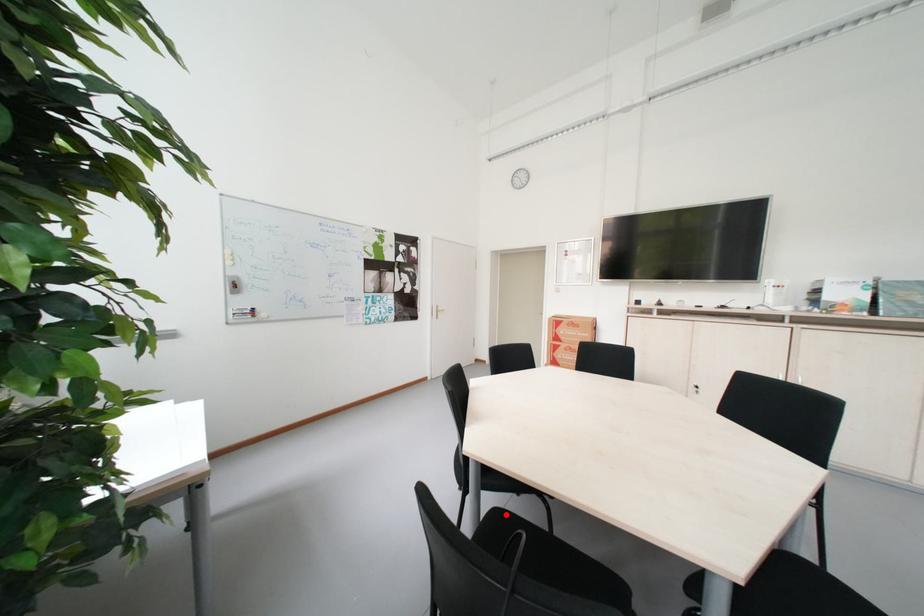
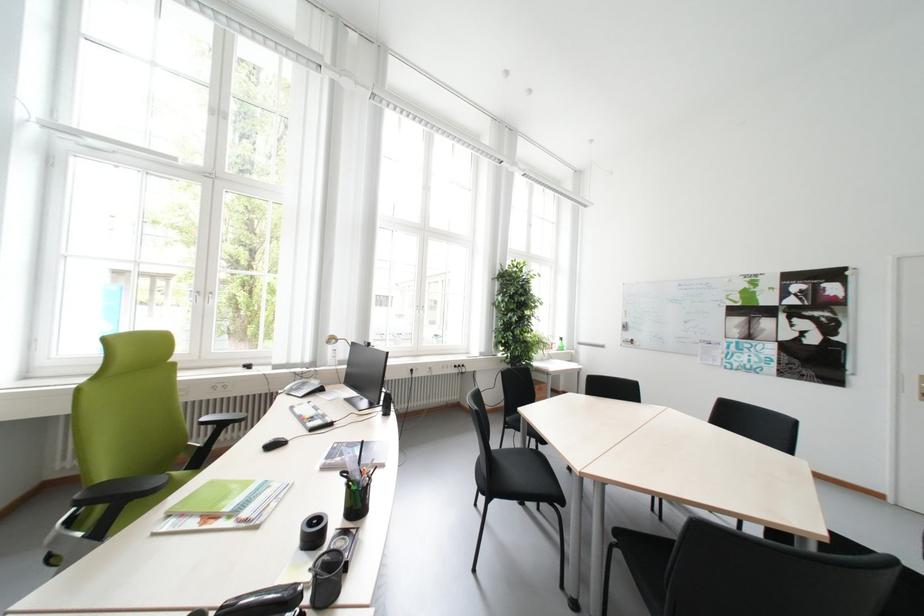
Question: I am providing you with two images of the same scene from different viewpoints. A red point is marked on the first image. Is the red point's position out of view in image 2?

Choices:
 (A) Yes
 (B) No

Answer: (A)